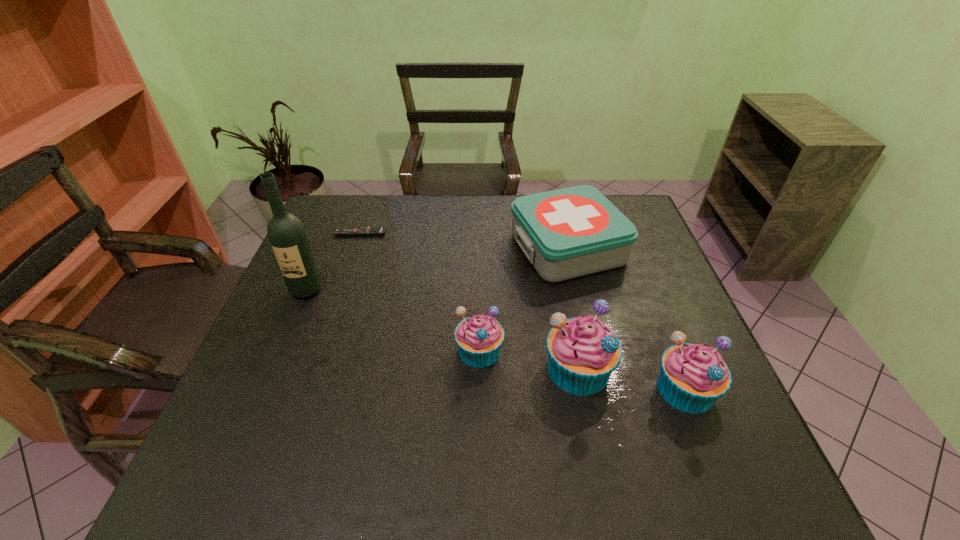
Please show where to add a muffin on the left while keeping spacing even. Please provide its 2D coordinates. Your answer should be formatted as a tuple, i.e. [(x, y)], where the tuple contains the x and y coordinates of a point satisfying the conditions above.

[(388, 333)]